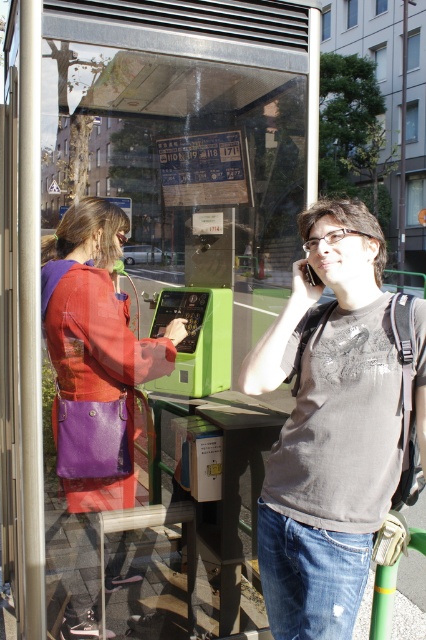
Does matte gray t-shirt at center have a greater width compared to purple leather bag at left?

No.

Does matte gray t-shirt at center have a lesser height compared to purple leather bag at left?

Yes.

Describe the element at coordinates (328, 428) in the screenshot. I see `matte gray t-shirt at center` at that location.

Locate an element on the screen. The image size is (426, 640). matte gray t-shirt at center is located at coordinates (328, 428).